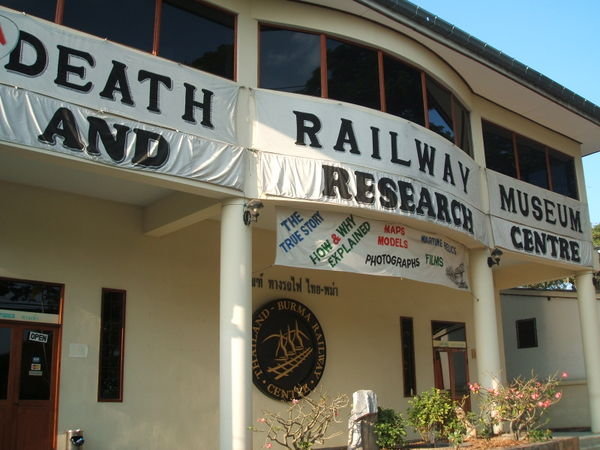
Where is `2 doors`? The width and height of the screenshot is (600, 450). 2 doors is located at coordinates (22, 417), (447, 376).